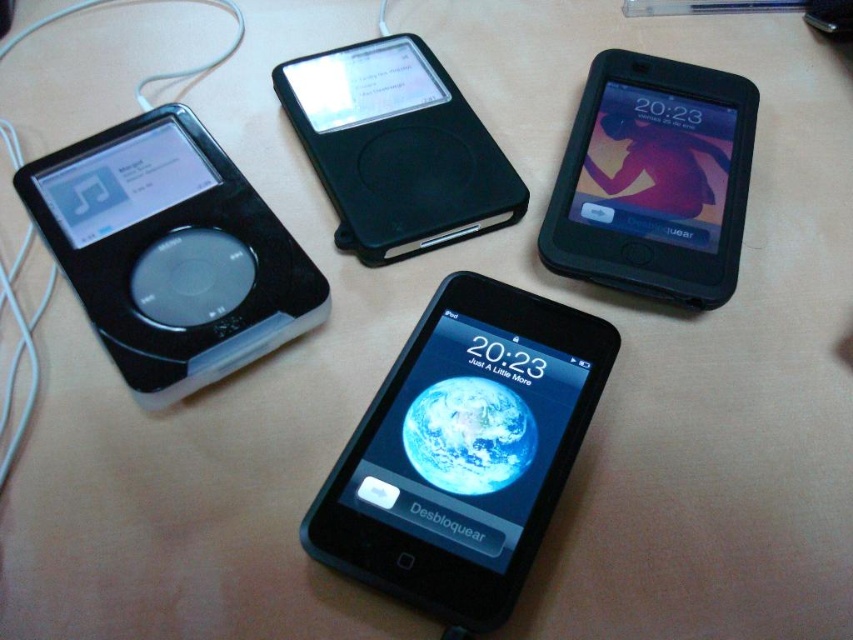
Question: Which point is farther to the camera?

Choices:
 (A) (606, 196)
 (B) (486, 362)
 (C) (427, 49)
 (D) (86, 173)

Answer: (C)

Question: Considering the relative positions of black matte phone at center and black matte ipod at upper center in the image provided, where is black matte phone at center located with respect to black matte ipod at upper center?

Choices:
 (A) below
 (B) above

Answer: (A)

Question: Estimate the real-world distances between objects in this image. Which object is closer to the black matte ipod at upper center?

Choices:
 (A) black plastic ipod at left
 (B) black matte phone at center
 (C) black rubberized phone at upper right

Answer: (A)

Question: Which of these objects is positioned farthest from the black matte ipod at upper center?

Choices:
 (A) black matte phone at center
 (B) black plastic ipod at left
 (C) black rubberized phone at upper right

Answer: (A)

Question: Is the position of black matte phone at center more distant than that of black matte ipod at upper center?

Choices:
 (A) yes
 (B) no

Answer: (B)

Question: Is the position of black rubberized phone at upper right less distant than that of black matte ipod at upper center?

Choices:
 (A) yes
 (B) no

Answer: (A)